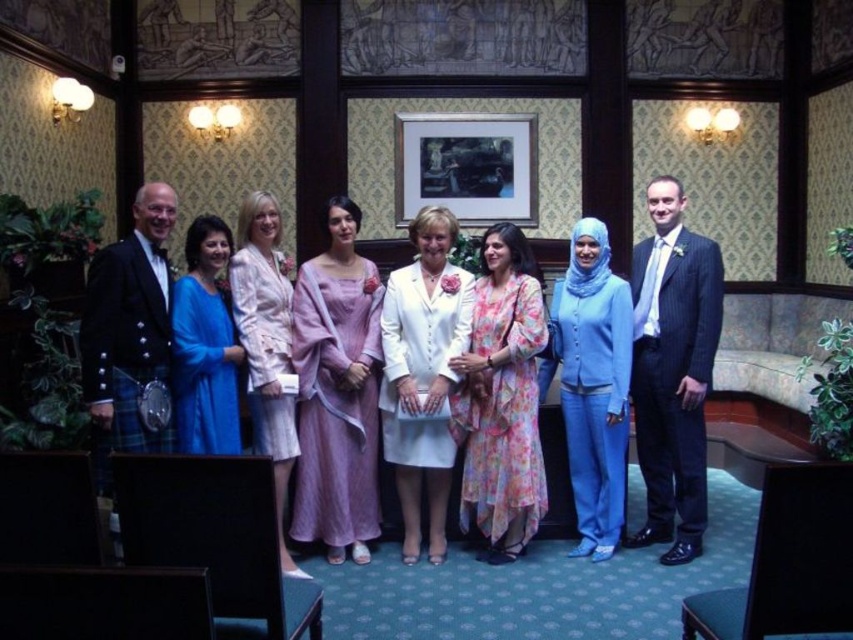
Is dark blue pinstripe suit at right wider than matte blue suit at center?

In fact, dark blue pinstripe suit at right might be narrower than matte blue suit at center.

Does dark blue pinstripe suit at right have a lesser width compared to matte blue suit at center?

Correct, dark blue pinstripe suit at right's width is less than matte blue suit at center's.

Who is more forward, (x=692, y=372) or (x=596, y=294)?

Point (x=692, y=372) is more forward.

At what (x,y) coordinates should I click in order to perform the action: click on dark blue pinstripe suit at right. Please return your answer as a coordinate pair (x, y). Image resolution: width=853 pixels, height=640 pixels. Looking at the image, I should click on (672, 369).

Does purple silk dress at center have a larger size compared to matte white dress at center?

Actually, purple silk dress at center might be smaller than matte white dress at center.

Locate an element on the screen. This screenshot has height=640, width=853. purple silk dress at center is located at coordinates (337, 392).

Locate an element on the screen. purple silk dress at center is located at coordinates (337, 392).

Where is `dark blue pinstripe suit at right`? The image size is (853, 640). dark blue pinstripe suit at right is located at coordinates (672, 369).

Is dark blue pinstripe suit at right below white satin dress at center?

Incorrect, dark blue pinstripe suit at right is not positioned below white satin dress at center.

The height and width of the screenshot is (640, 853). I want to click on dark blue pinstripe suit at right, so click(x=672, y=369).

Where is `dark blue pinstripe suit at right`? The image size is (853, 640). dark blue pinstripe suit at right is located at coordinates (672, 369).